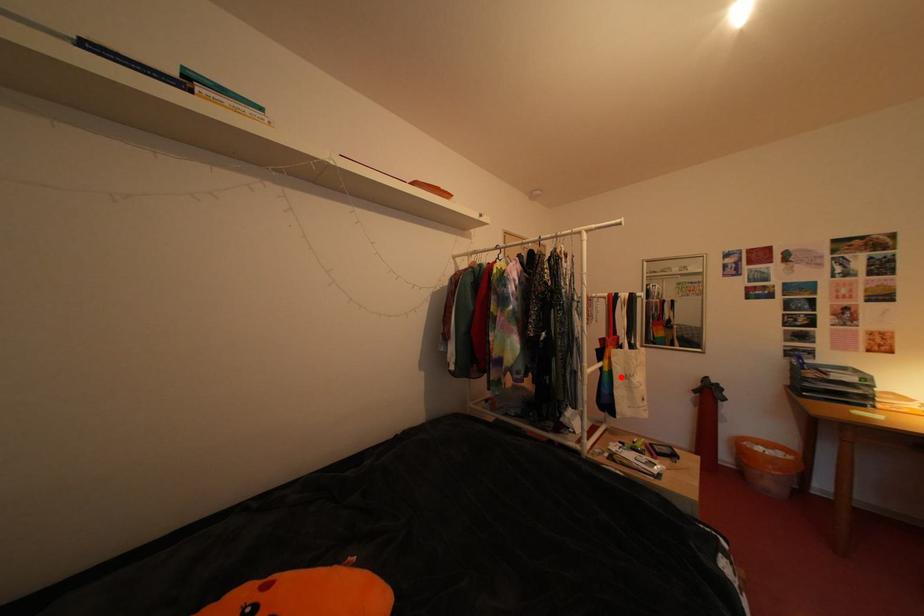
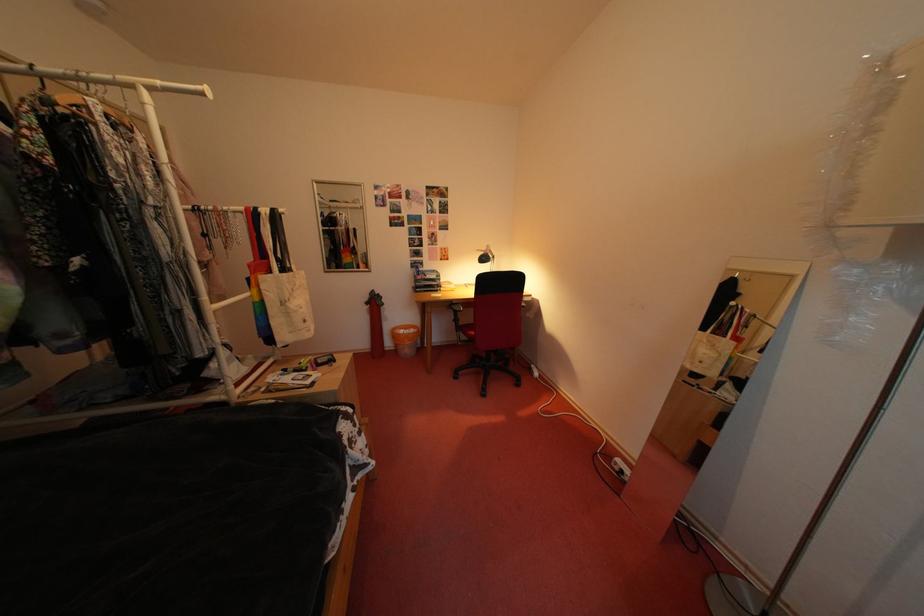
In the second image, find the point that corresponds to the highlighted location in the first image.

(273, 306)